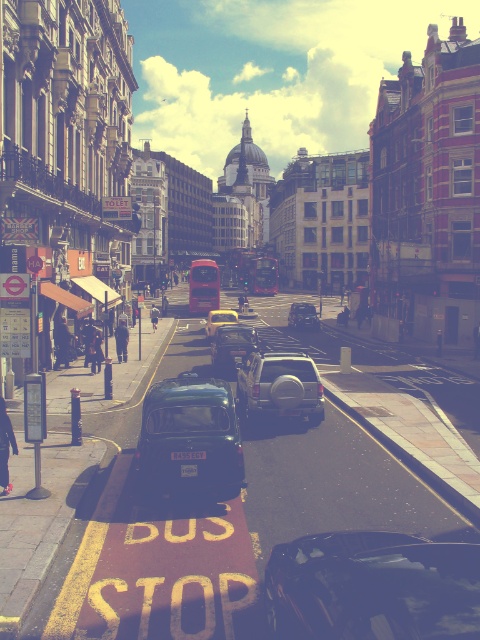
Can you confirm if shiny dark green car at center is positioned to the right of metallic silver car at center?

In fact, shiny dark green car at center is to the left of metallic silver car at center.

Does point (201, 419) come closer to viewer compared to point (253, 342)?

Yes.

This screenshot has height=640, width=480. Find the location of `shiny dark green car at center`. shiny dark green car at center is located at coordinates (191, 433).

Between red metallic bus at center and black plastic license plate at center, which one has less height?

With less height is black plastic license plate at center.

Does red metallic bus at center have a greater height compared to black plastic license plate at center?

Correct, red metallic bus at center is much taller as black plastic license plate at center.

I want to click on red metallic bus at center, so click(x=204, y=285).

Identify the location of red metallic bus at center. (204, 285).

How much distance is there between yellow matte taxi at center and black plastic license plate at center?

yellow matte taxi at center is 81.38 feet from black plastic license plate at center.

Between yellow matte taxi at center and black plastic license plate at center, which one is positioned higher?

yellow matte taxi at center is above.

Describe the element at coordinates (218, 321) in the screenshot. I see `yellow matte taxi at center` at that location.

Where is `yellow matte taxi at center`? The image size is (480, 640). yellow matte taxi at center is located at coordinates (218, 321).